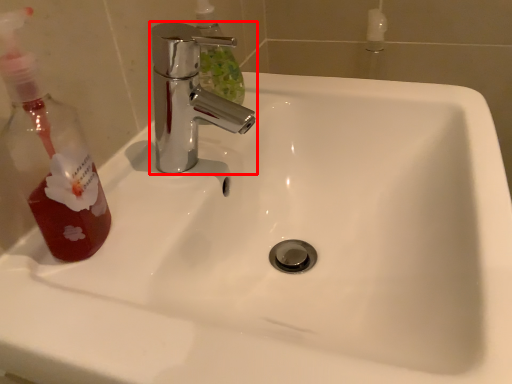
Question: In this image, where is tap (annotated by the red box) located relative to mouthwash?

Choices:
 (A) left
 (B) right

Answer: (B)